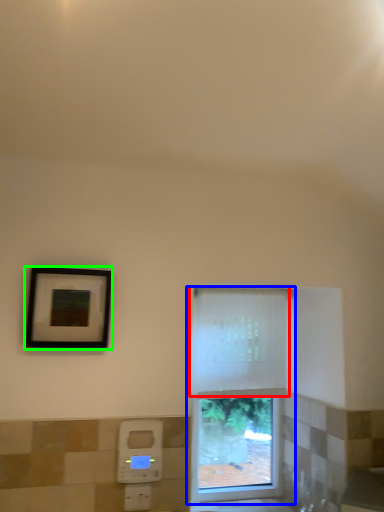
Question: Which object is positioned farthest from curtain (highlighted by a red box)? Select from window (highlighted by a blue box) and picture frame (highlighted by a green box).

Choices:
 (A) window
 (B) picture frame

Answer: (B)